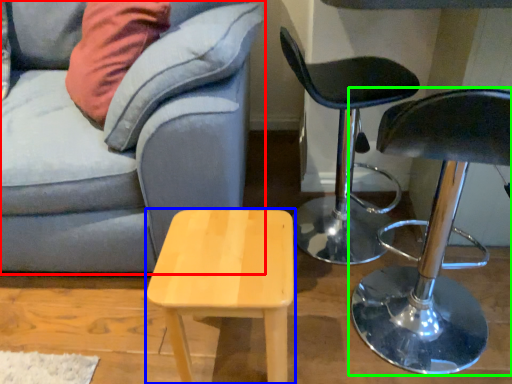
Question: Which object is the closest to the studio couch (highlighted by a red box)? Choose among these: stool (highlighted by a blue box) or chair (highlighted by a green box).

Choices:
 (A) stool
 (B) chair

Answer: (A)